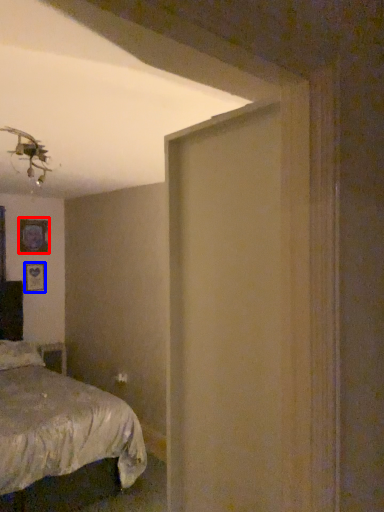
Question: Among these objects, which one is farthest to the camera, picture frame (highlighted by a red box) or picture frame (highlighted by a blue box)?

Choices:
 (A) picture frame
 (B) picture frame

Answer: (B)